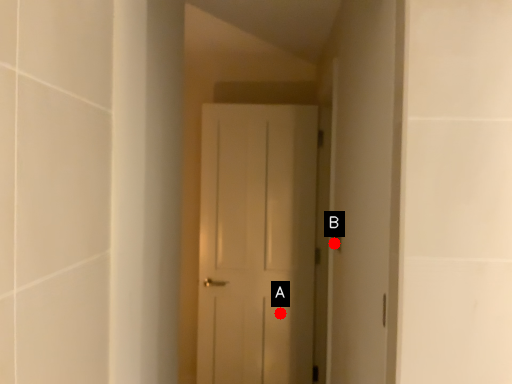
Question: Two points are circled on the image, labeled by A and B beside each circle. Which point appears closest to the camera in this image?

Choices:
 (A) A is closer
 (B) B is closer

Answer: (B)